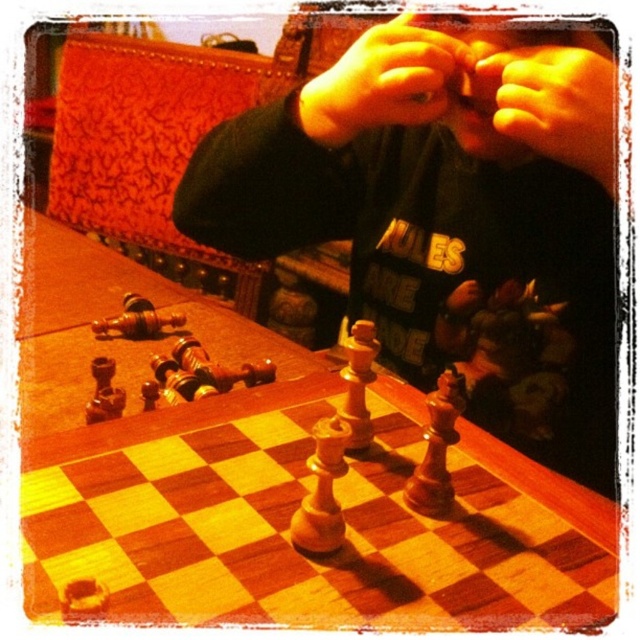
Can you confirm if smooth skin hand at upper center is shorter than yellowish skin at center?

In fact, smooth skin hand at upper center may be taller than yellowish skin at center.

Locate an element on the screen. smooth skin hand at upper center is located at coordinates (556, 104).

Which is in front, point (577, 156) or point (340, 96)?

Point (577, 156) is more forward.

The image size is (640, 640). Identify the location of smooth skin hand at upper center. (556, 104).

Is wooden chess pieces at center closer to the viewer compared to smooth skin hand at upper center?

No, it is not.

Is wooden chess pieces at center positioned at the back of smooth skin hand at upper center?

Yes, wooden chess pieces at center is further from the viewer.

Find the location of a particular element. wooden chess pieces at center is located at coordinates (449, 218).

Identify the location of wooden chess pieces at center. The image size is (640, 640). (449, 218).

Is wooden chessboard at center above wooden chess pieces at center?

No, wooden chessboard at center is not above wooden chess pieces at center.

Does wooden chessboard at center have a greater width compared to wooden chess pieces at center?

Correct, the width of wooden chessboard at center exceeds that of wooden chess pieces at center.

What do you see at coordinates (266, 483) in the screenshot? This screenshot has width=640, height=640. I see `wooden chessboard at center` at bounding box center [266, 483].

You are a GUI agent. You are given a task and a screenshot of the screen. Output one action in this format:
    pyautogui.click(x=<x>, y=<y>)
    Task: Click on the wooden chessboard at center
    The height and width of the screenshot is (640, 640).
    Given the screenshot: What is the action you would take?
    pyautogui.click(x=266, y=483)